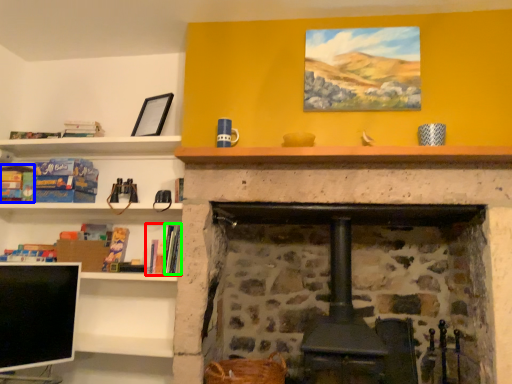
Question: Which object is the farthest from book (highlighted by a red box)? Choose among these: book (highlighted by a blue box) or book (highlighted by a green box).

Choices:
 (A) book
 (B) book

Answer: (A)